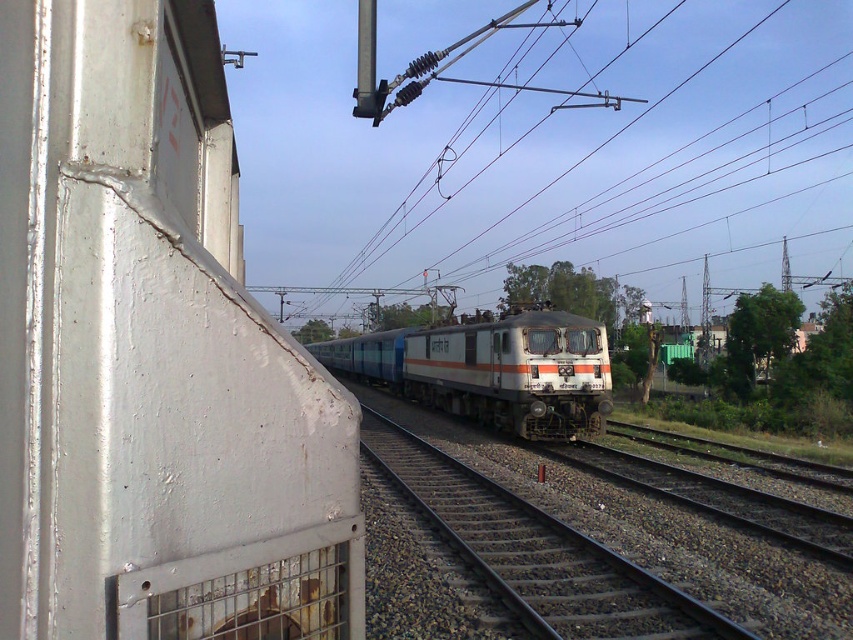
You are a bird flying towards the metallic wire at upper center and the silver metallic train at center. Which object will you reach first?

The metallic wire at upper center is closer to you than the silver metallic train at center, so you will reach the metallic wire at upper center first.

You are standing at the point where the image was taken. There is a metallic wire at upper center located at point (x=630, y=160). If you want to avoid walking into this wire, in which direction should you move relative to your current position?

To avoid the metallic wire at upper center located at point (x=630, y=160), you should move downward from your current position since the wire is positioned above you.